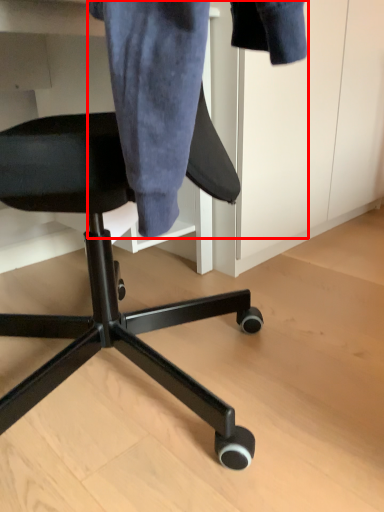
Question: From the image's perspective, what is the correct spatial relationship of denim jacket (annotated by the red box) in relation to chair?

Choices:
 (A) above
 (B) below

Answer: (A)